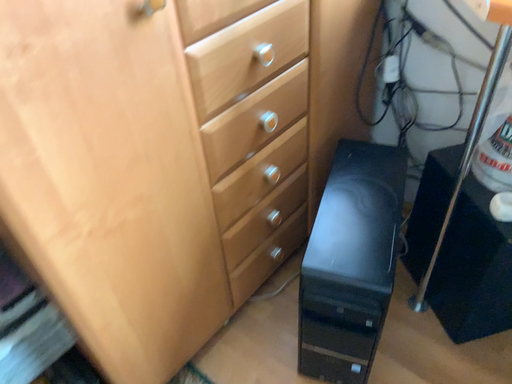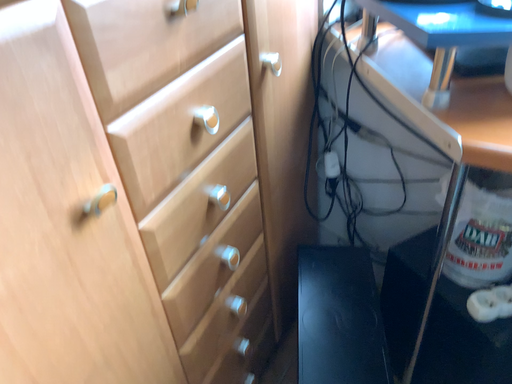
Question: How did the camera likely rotate when shooting the video?

Choices:
 (A) rotated downward
 (B) rotated upward

Answer: (B)